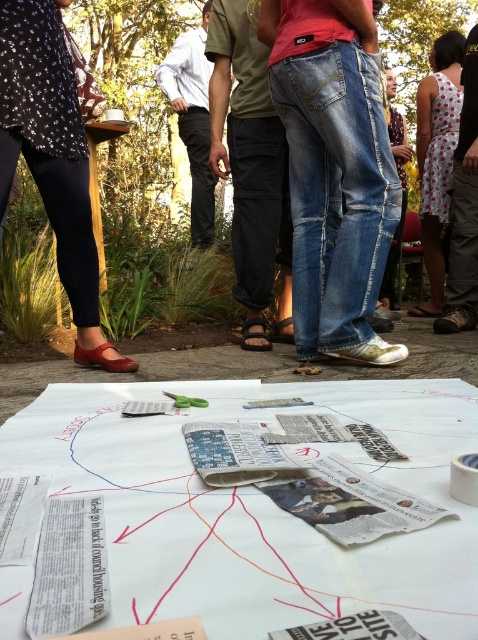
Question: Is denim jeans at center to the right of white shirt at center from the viewer's perspective?

Choices:
 (A) yes
 (B) no

Answer: (A)

Question: Which of the following is the closest to the observer?

Choices:
 (A) (399, 156)
 (B) (337, 301)

Answer: (B)

Question: Is denim jeans at center below white dotted dress at center?

Choices:
 (A) yes
 (B) no

Answer: (A)

Question: Which of the following is the farthest from the observer?

Choices:
 (A) white shirt at center
 (B) denim jeans at center
 (C) white dotted dress at center

Answer: (C)

Question: Which point appears closest to the camera in this image?

Choices:
 (A) (301, 292)
 (B) (288, 324)
 (C) (466, 300)

Answer: (A)

Question: Is black canvas pants at center below white dotted dress at center?

Choices:
 (A) no
 (B) yes

Answer: (B)